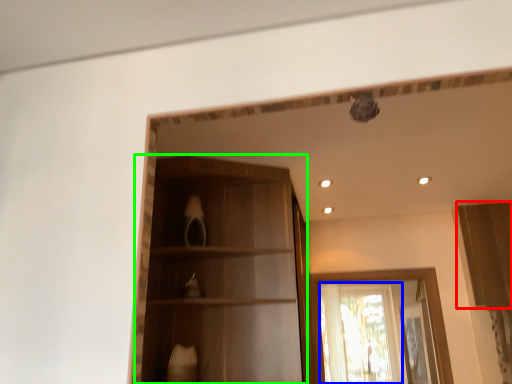
Question: Which object is positioned farthest from cabinetry (highlighted by a red box)? Select from window (highlighted by a blue box) and cabinetry (highlighted by a green box).

Choices:
 (A) window
 (B) cabinetry

Answer: (B)